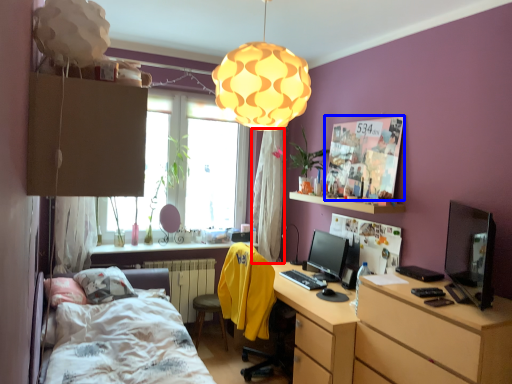
Question: Which object appears farthest to the camera in this image, curtain (highlighted by a red box) or poster page (highlighted by a blue box)?

Choices:
 (A) curtain
 (B) poster page

Answer: (A)